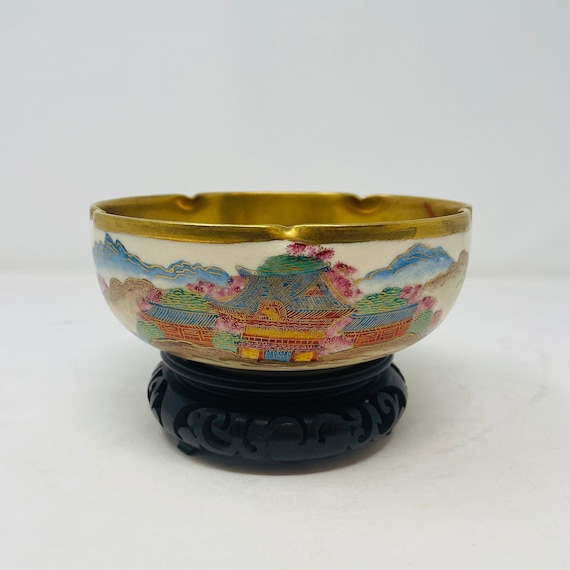
Image resolution: width=570 pixels, height=570 pixels. In order to click on bowl in this screenshot , I will do `click(233, 256)`.